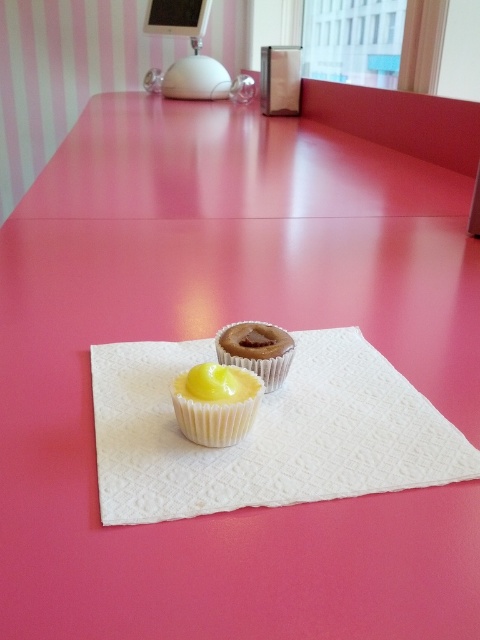
You are looking at the image of the table with two points marked. Which of the two points, point (252, 374) or point (276, 333), is closer to you?

Point (252, 374) is closer to the camera than point (276, 333).

You are a chef preparing to decorate a dessert table. You see the yellow matte muffin at center and the chocolate matte muffin at center. Which one is positioned lower on the table?

The yellow matte muffin at center is positioned lower on the table than the chocolate matte muffin at center.

From the picture: You are a delivery robot tasked with placing a small package on the table. The package must be placed exactly at the point marked as point (216, 403). However, there are obstacles on the table. Where should you place the package so it doesn not interfere with the yellow matte muffin at center?

The point (216, 403) is on the yellow matte muffin at center, so you cannot place the package there. You need to choose another location on the table that is not occupied by the muffin.